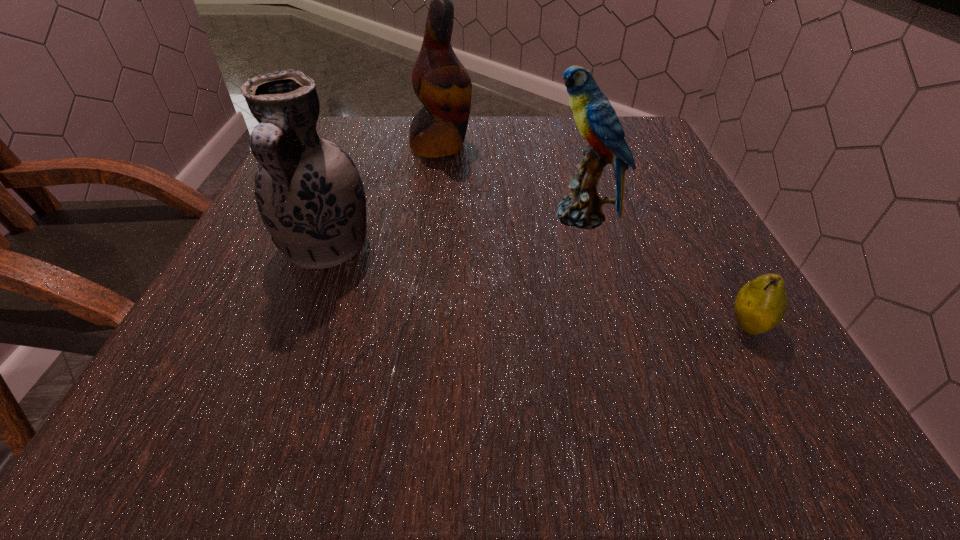
The image size is (960, 540). I want to click on vacant area that lies between the pear and the farthest object, so click(x=595, y=236).

Where is `vacant space in between the shorter parrot and the pear`? This screenshot has width=960, height=540. vacant space in between the shorter parrot and the pear is located at coordinates (664, 271).

The height and width of the screenshot is (540, 960). Find the location of `empty location between the vase and the third object from right to left`. empty location between the vase and the third object from right to left is located at coordinates (384, 197).

Find the location of a particular element. The image size is (960, 540). empty space between the farther parrot and the leftmost object is located at coordinates coord(384,197).

Where is `object that is the second closest one to the pear`? object that is the second closest one to the pear is located at coordinates (309, 193).

Locate an element on the screen. This screenshot has width=960, height=540. object that stands as the second closest to the pear is located at coordinates (309, 193).

Where is `vacant area in the image that satisfies the following two spatial constraints: 1. on the face of the nearer parrot; 2. on the back side of the pear`? vacant area in the image that satisfies the following two spatial constraints: 1. on the face of the nearer parrot; 2. on the back side of the pear is located at coordinates (612, 326).

Image resolution: width=960 pixels, height=540 pixels. Find the location of `vacant region that satisfies the following two spatial constraints: 1. on the face of the rightmost object; 2. on the right side of the nearer parrot`. vacant region that satisfies the following two spatial constraints: 1. on the face of the rightmost object; 2. on the right side of the nearer parrot is located at coordinates (612, 326).

Locate an element on the screen. The image size is (960, 540). vacant space that satisfies the following two spatial constraints: 1. on the face of the shorter parrot; 2. on the right side of the rightmost object is located at coordinates (612, 326).

The image size is (960, 540). I want to click on vacant space that satisfies the following two spatial constraints: 1. with the handle on the side of the rightmost object; 2. on the left side of the leftmost object, so click(x=297, y=326).